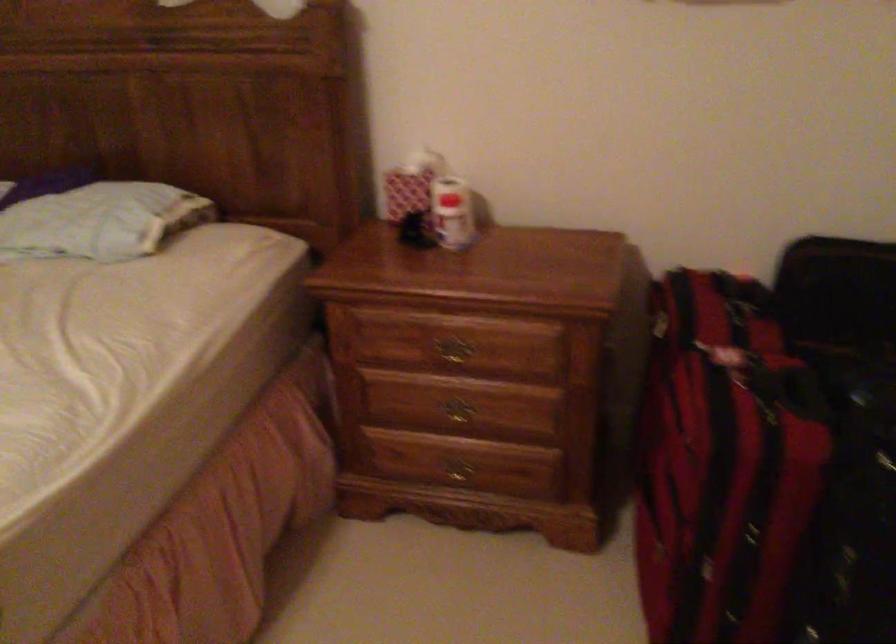
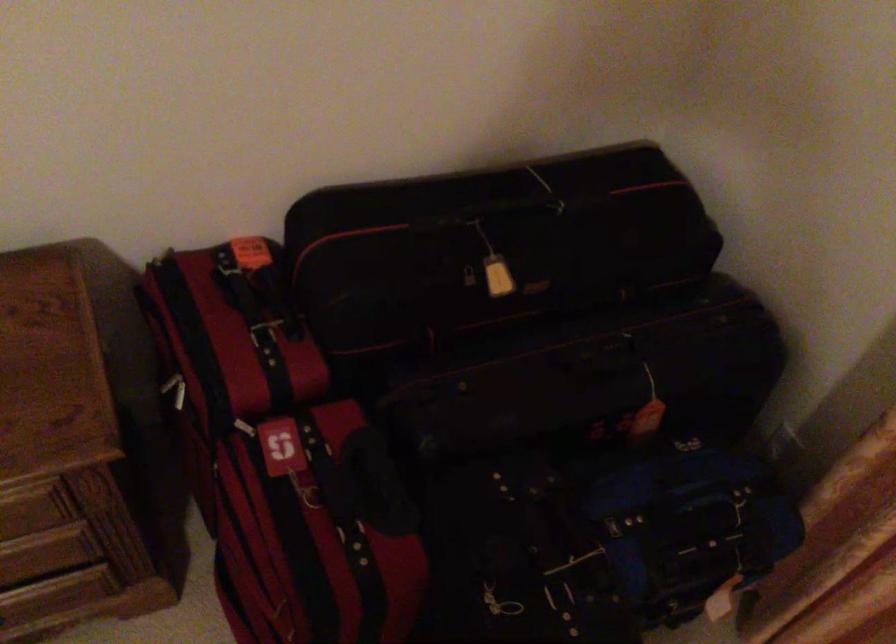
Where in the second image is the point corresponding to (729,307) from the first image?

(264, 334)